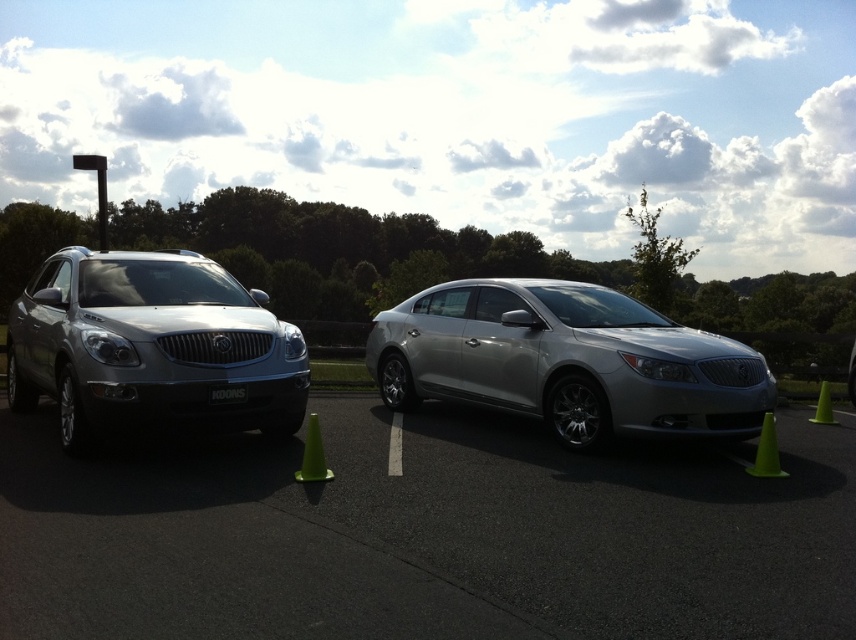
At what (x,y) coordinates should I click in order to perform the action: click on satin silver sedan at center. Please return your answer as a coordinate pair (x, y). The image size is (856, 640). Looking at the image, I should click on (568, 362).

Can you confirm if satin silver sedan at center is shorter than satin silver suv at left?

Indeed, satin silver sedan at center has a lesser height compared to satin silver suv at left.

This screenshot has height=640, width=856. I want to click on satin silver sedan at center, so click(x=568, y=362).

Does satin silver car at center come behind green plastic traffic cone at right?

No, satin silver car at center is closer to the viewer.

Which is more to the right, satin silver car at center or green plastic traffic cone at right?

From the viewer's perspective, green plastic traffic cone at right appears more on the right side.

From the picture: Who is more distant from viewer, (311, 518) or (825, 394)?

Point (825, 394)

The image size is (856, 640). Identify the location of satin silver car at center. (426, 536).

Is green plastic traffic cone at right bigger than black plastic license plate at center?

Indeed, green plastic traffic cone at right has a larger size compared to black plastic license plate at center.

Is point (828, 381) positioned in front of point (232, 394)?

No.

The height and width of the screenshot is (640, 856). What do you see at coordinates (823, 406) in the screenshot?
I see `green plastic traffic cone at right` at bounding box center [823, 406].

The height and width of the screenshot is (640, 856). In order to click on green plastic traffic cone at right in this screenshot , I will do `click(823, 406)`.